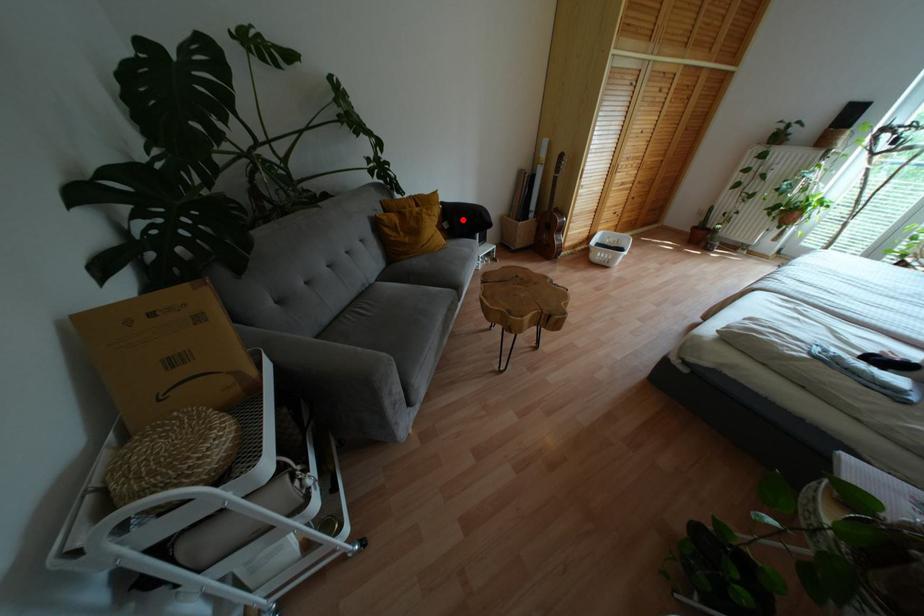
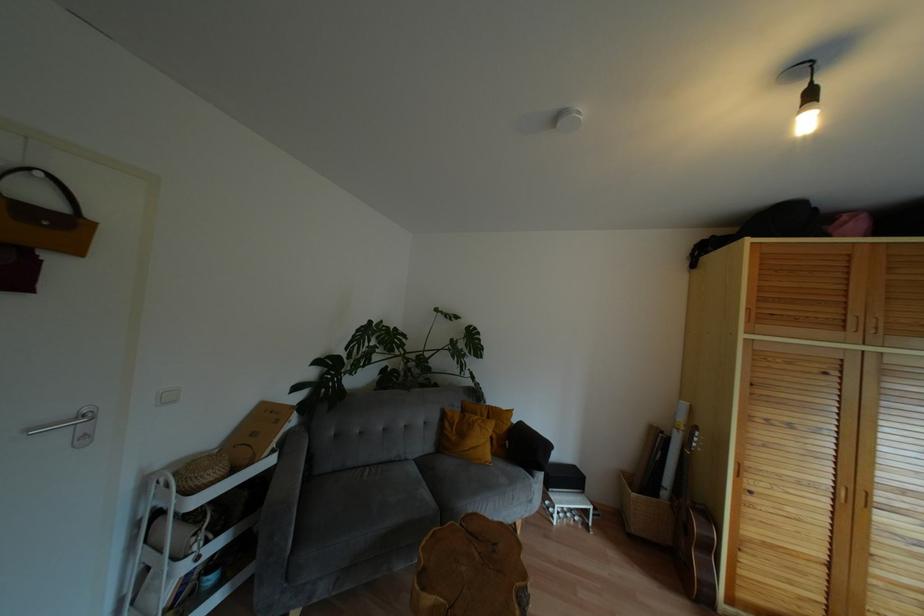
Locate, in the second image, the point that corresponds to the highlighted location in the first image.

(524, 448)